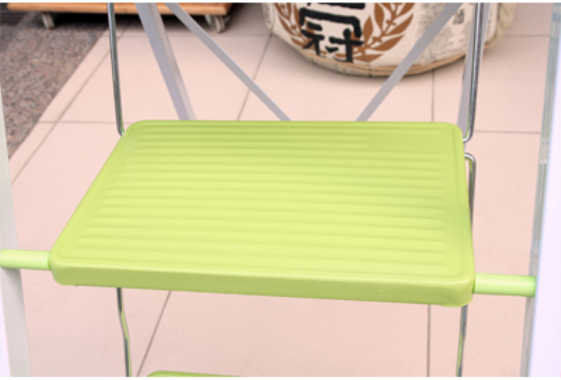
You are a GUI agent. You are given a task and a screenshot of the screen. Output one action in this format:
    pyautogui.click(x=<x>, y=<y>)
    Task: Click on the bottom half of large vase
    The image size is (561, 380).
    Given the screenshot: What is the action you would take?
    pyautogui.click(x=361, y=47)